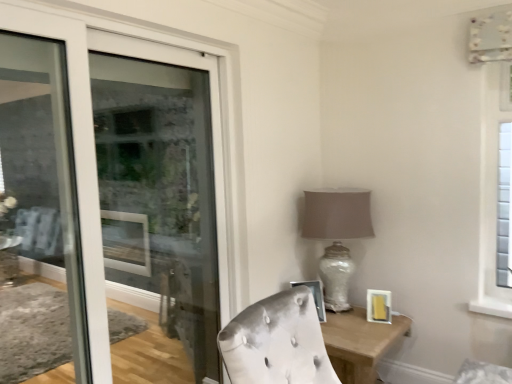
At what (x,y) coordinates should I click in order to perform the action: click on vacant space to the right of metallic silver picture frame at center, which is the 1th picture frame in left-to-right order. Please return your answer as a coordinate pair (x, y). This screenshot has width=512, height=384. Looking at the image, I should click on [336, 319].